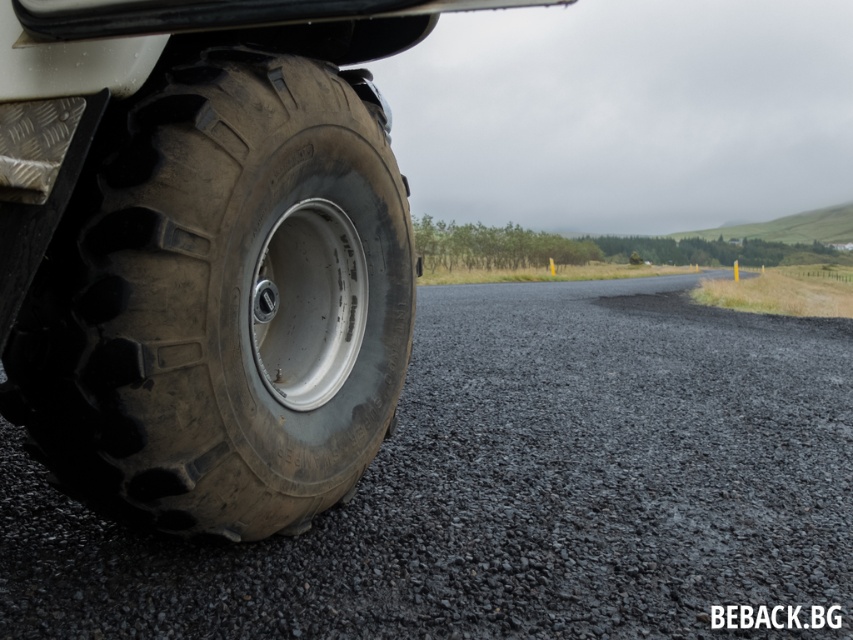
Question: Which point appears closest to the camera in this image?

Choices:
 (A) (x=757, y=516)
 (B) (x=199, y=278)

Answer: (B)

Question: Can you confirm if black gravel at lower left is positioned below black rubber tire at lower left?

Choices:
 (A) yes
 (B) no

Answer: (A)

Question: Among these objects, which one is nearest to the camera?

Choices:
 (A) black gravel at lower left
 (B) black rubber tire at lower left

Answer: (B)

Question: Does black gravel at lower left have a larger size compared to black rubber tire at lower left?

Choices:
 (A) no
 (B) yes

Answer: (B)

Question: Which point is farther from the camera taking this photo?

Choices:
 (A) (463, 374)
 (B) (271, 256)

Answer: (A)

Question: Is the position of black gravel at lower left more distant than that of black rubber tire at lower left?

Choices:
 (A) yes
 (B) no

Answer: (A)